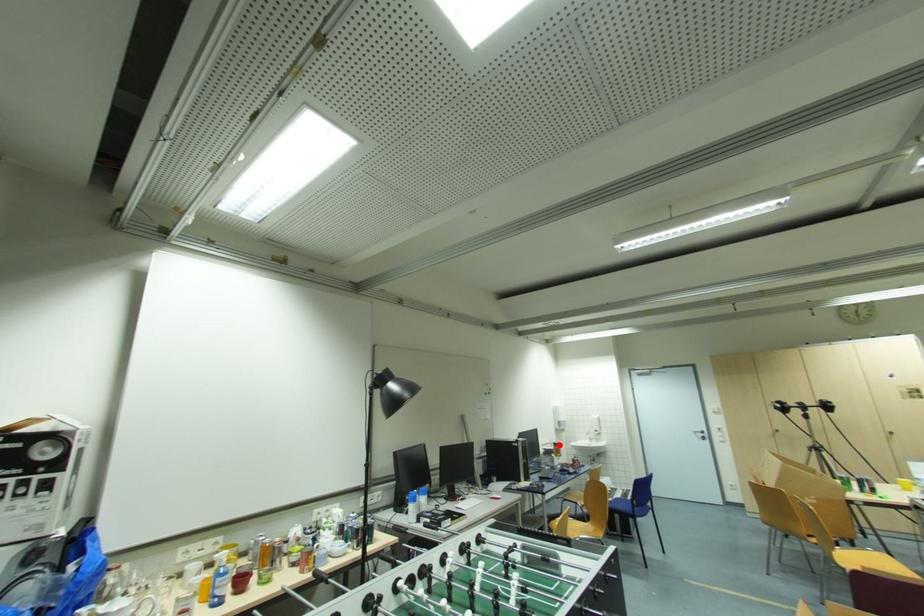
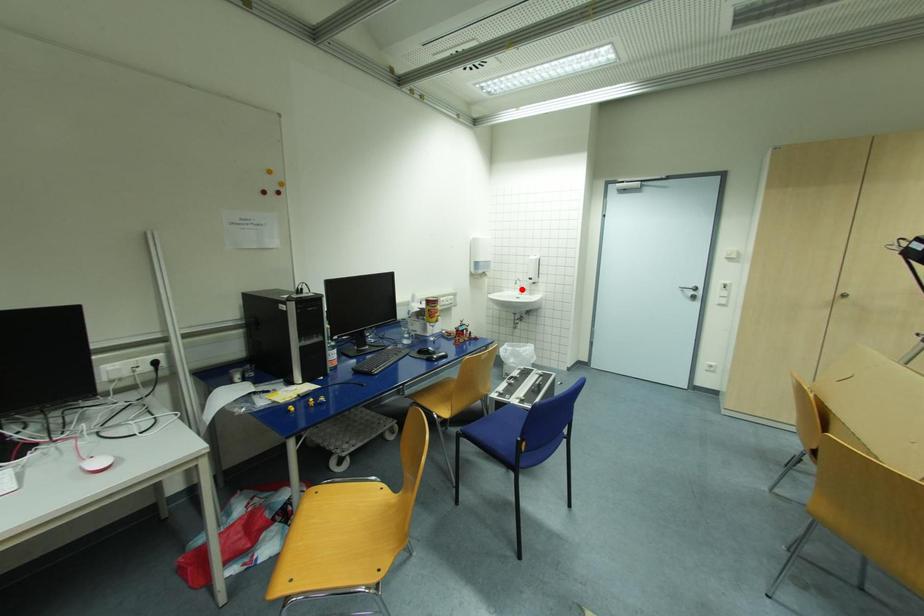
I am providing you with two images of the same scene from different viewpoints. A red point is marked on the first image and another point is marked on the second image. Is the marked point in image1 the same physical position as the marked point in image2?

No